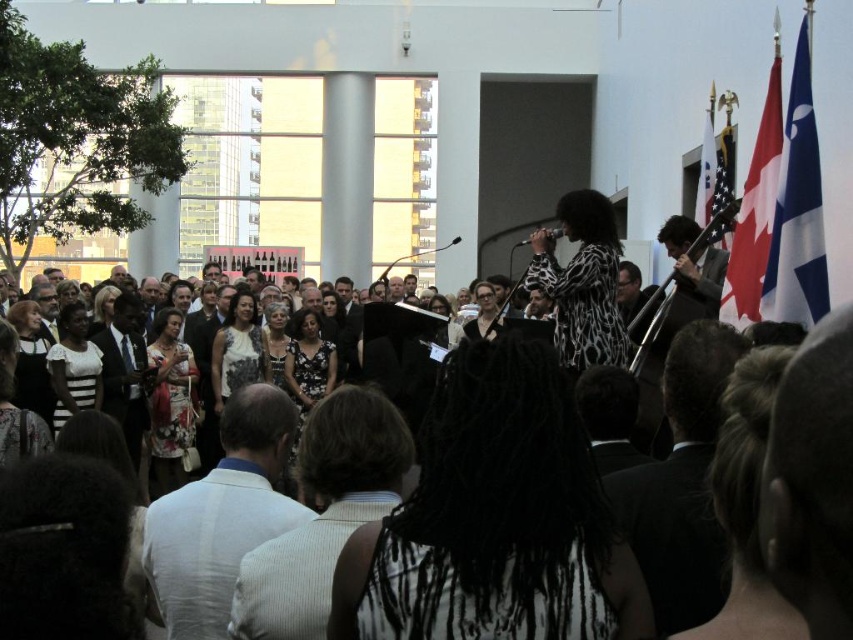
You are a stagehand who needs to move a 30 meter long banner from the floral dress at center to the white fabric flag at upper right. Is the distance sufficient to place the banner end to end between them?

The distance between the floral dress at center and the white fabric flag at upper right is 30.30 meters, which is just slightly longer than the banner. Therefore, the banner can be placed end to end between them with a small amount of space remaining.

You are a photographer at the event and want to capture a photo of the singer. The singer is facing the audience, and you need to ensure that both the white textured hair at center and the white textured shirt at center are clearly visible in the frame. Based on their positions, which object should appear to the right in your photo?

The white textured hair at center is positioned on the right side of the white textured shirt at center, so in the photo, the white textured hair at center will appear to the right of the white textured shirt at center.